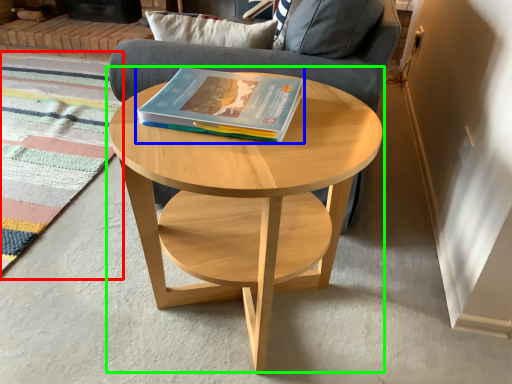
Question: Which object is positioned farthest from mat (highlighted by a red box)? Select from book (highlighted by a blue box) and coffee table (highlighted by a green box).

Choices:
 (A) book
 (B) coffee table

Answer: (A)